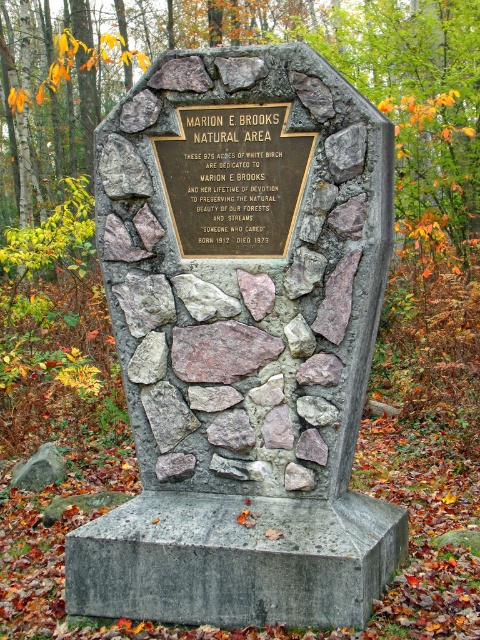
Which is more to the right, rustic stone marker at center or rusty stone at center?

Positioned to the right is rustic stone marker at center.

Is rustic stone marker at center positioned behind rusty stone at center?

No, rustic stone marker at center is in front of rusty stone at center.

Which is behind, point (123, 380) or point (197, 348)?

Point (123, 380)

Identify the location of rustic stone marker at center. (247, 324).

Who is lower down, gold polished metal plaque at center or rusty stone at center?

Positioned lower is rusty stone at center.

The height and width of the screenshot is (640, 480). What are the coordinates of `gold polished metal plaque at center` in the screenshot? It's located at (233, 179).

Is rustic stone marker at center to the right of gold polished metal plaque at center from the viewer's perspective?

Indeed, rustic stone marker at center is positioned on the right side of gold polished metal plaque at center.

Is rustic stone marker at center above gold polished metal plaque at center?

Actually, rustic stone marker at center is below gold polished metal plaque at center.

Describe the element at coordinates (247, 324) in the screenshot. I see `rustic stone marker at center` at that location.

This screenshot has height=640, width=480. Identify the location of rustic stone marker at center. (247, 324).